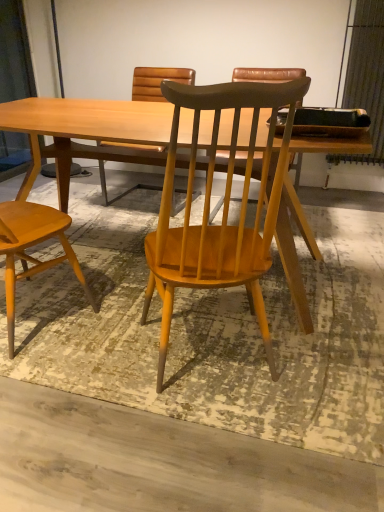
Where is `vacant space situated on the left part of wooden chair at center, arranged as the second chair when viewed from the left`? The height and width of the screenshot is (512, 384). vacant space situated on the left part of wooden chair at center, arranged as the second chair when viewed from the left is located at coordinates (98, 354).